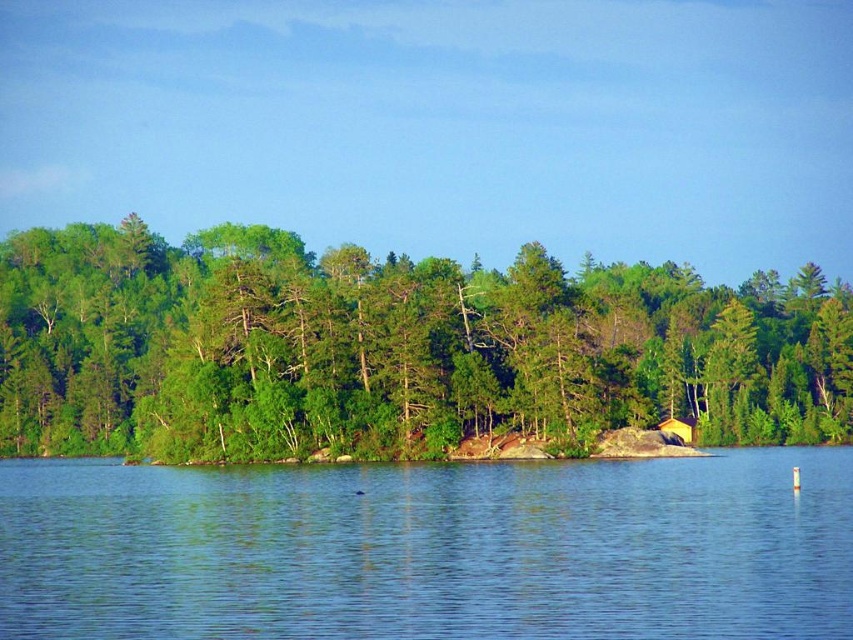
Question: Considering the real-world distances, which object is closest to the yellow wood hut at center?

Choices:
 (A) clear blue water at center
 (B) green leafy trees at center

Answer: (B)

Question: Observing the image, what is the correct spatial positioning of green leafy trees at center in reference to clear blue water at center?

Choices:
 (A) left
 (B) right

Answer: (B)

Question: Can you confirm if green leafy trees at center is positioned above yellow wood hut at center?

Choices:
 (A) no
 (B) yes

Answer: (B)

Question: From the image, what is the correct spatial relationship of green leafy trees at center in relation to clear blue water at center?

Choices:
 (A) right
 (B) left

Answer: (A)

Question: Which point appears closest to the camera in this image?

Choices:
 (A) (424, 576)
 (B) (689, 422)
 (C) (22, 342)

Answer: (A)

Question: Which is nearer to the green leafy trees at center?

Choices:
 (A) yellow wood hut at center
 (B) clear blue water at center

Answer: (A)